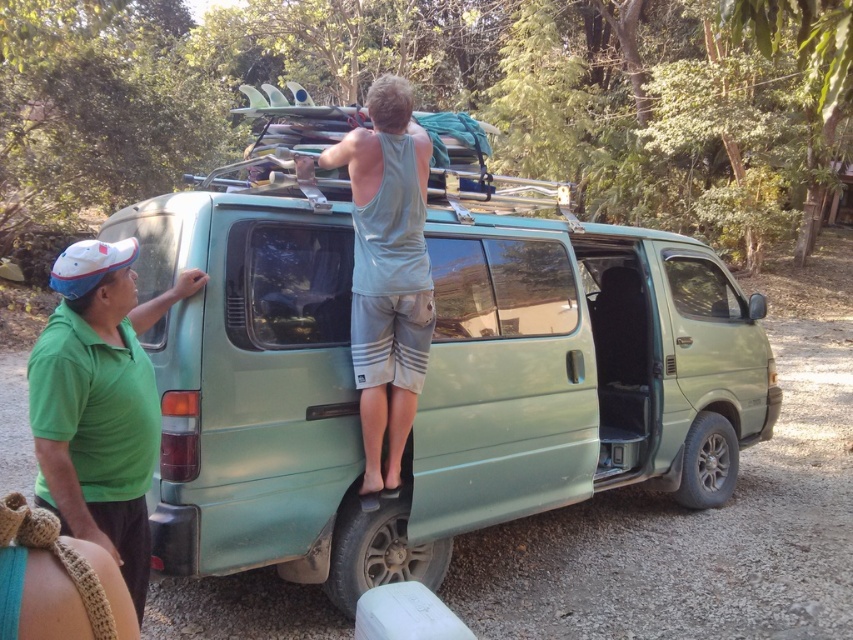
Based on the scene description, what are the coordinates of the green matte van at center?

The green matte van at center is located at coordinates point (428, 378).

You are a photographer positioned at the center of the scene. You want to capture a photo that includes both the green matte shirt at left and the person on the van. Which direction should you move to ensure both subjects are in frame?

The green matte shirt at left is located at point (99, 403), so you should move to the right to include both the green matte shirt at left and the person on the van in the frame.

You are a photographer trying to capture a wide shot of the scene. Given that the green matte van at center is larger in size than the green matte shirt at left, which object should you focus on to ensure both are in frame without cropping?

You should focus on the green matte van at center since it is larger and central to the scene, ensuring the green matte shirt at left remains in frame without cropping.